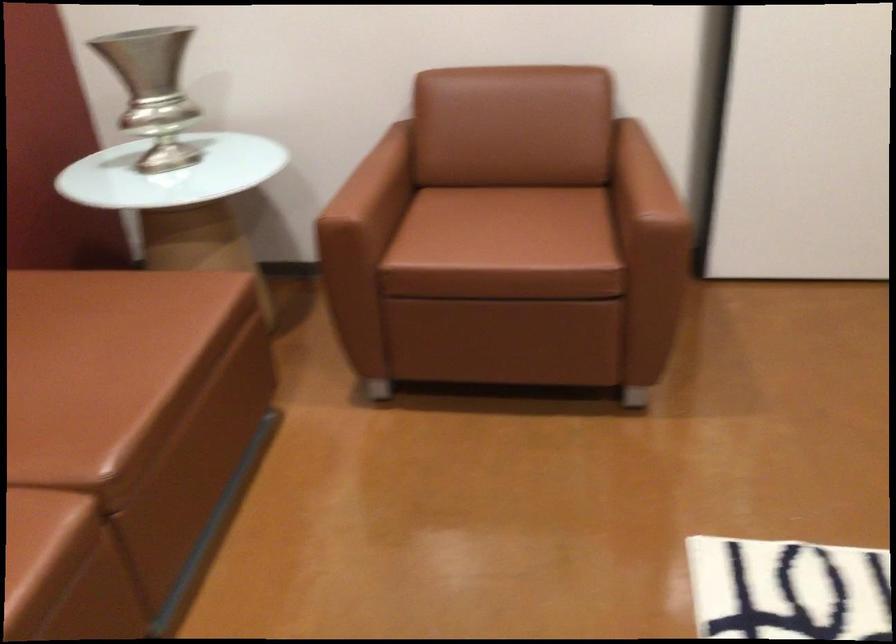
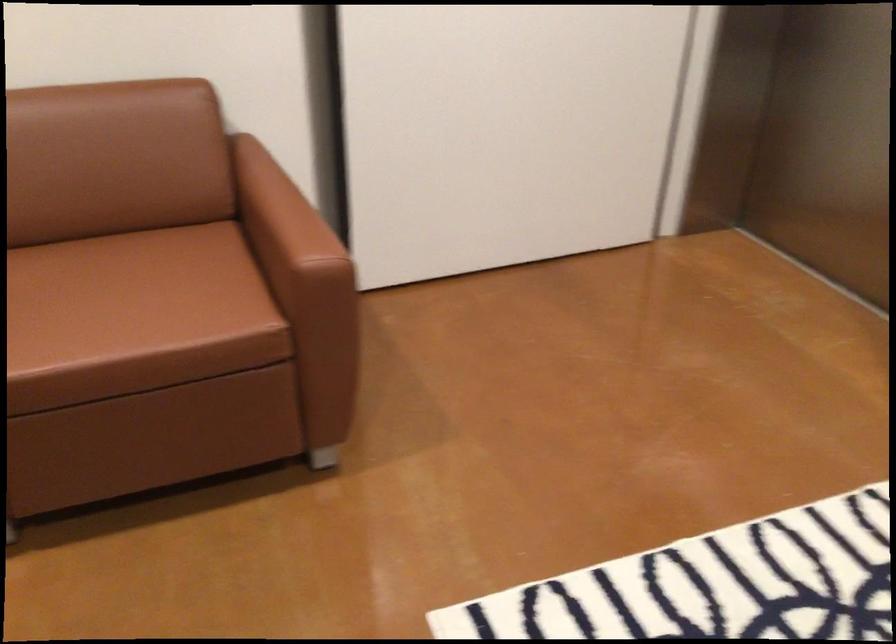
Where in the second image is the point corresponding to point 643,176 from the first image?

(282, 216)